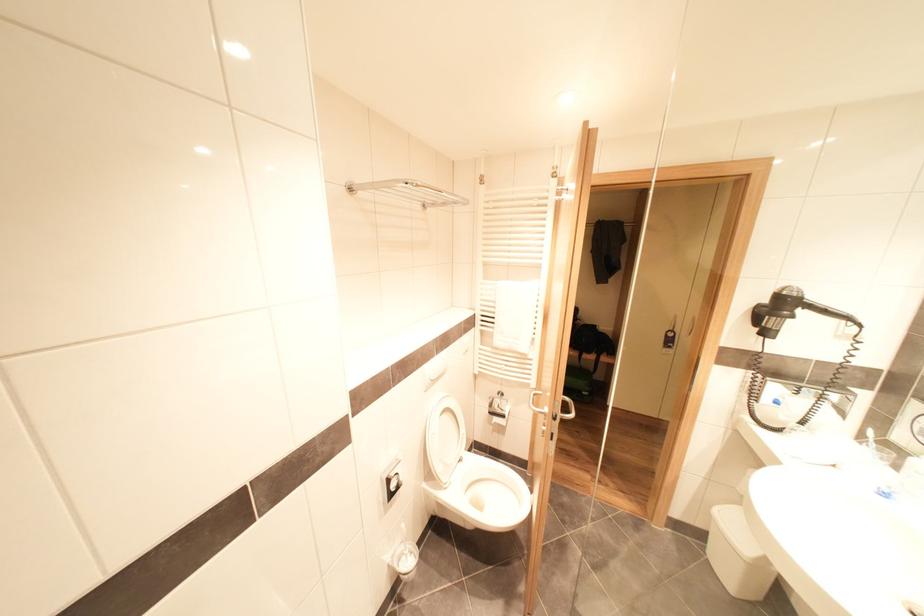
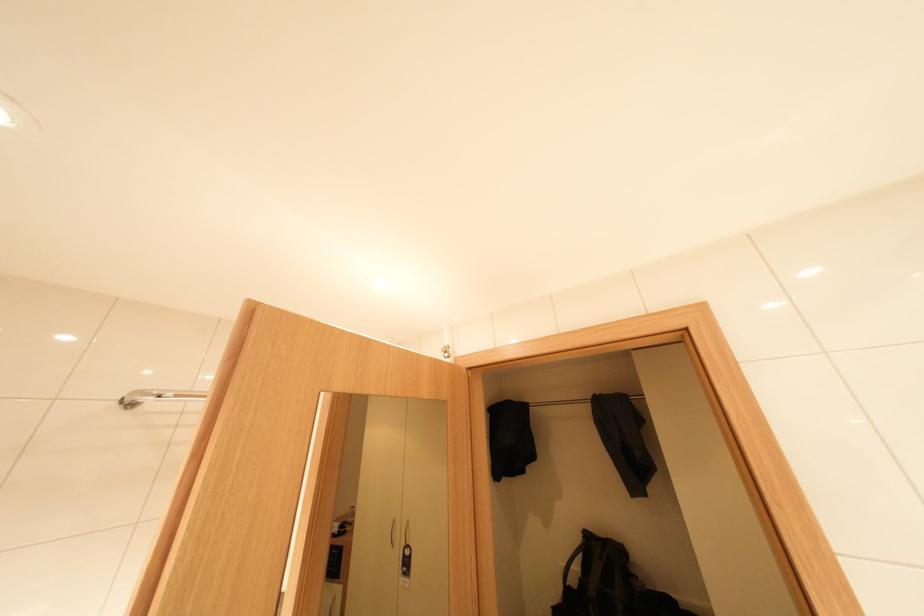
Find the pixel in the second image that matches (355,185) in the first image.

(130, 399)